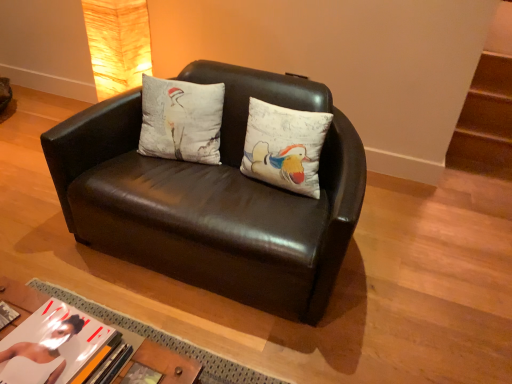
Question: Can you confirm if matte beige lampshade at upper left is smaller than matte paper book at lower left, arranged as the first book when viewed from the left?

Choices:
 (A) no
 (B) yes

Answer: (A)

Question: Considering the relative sizes of matte beige lampshade at upper left and matte paper book at lower left, which is the second book in right-to-left order, in the image provided, is matte beige lampshade at upper left bigger than matte paper book at lower left, which is the second book in right-to-left order,?

Choices:
 (A) no
 (B) yes

Answer: (B)

Question: Considering the relative sizes of matte beige lampshade at upper left and matte paper book at lower left, which is the second book in right-to-left order, in the image provided, is matte beige lampshade at upper left taller than matte paper book at lower left, which is the second book in right-to-left order,?

Choices:
 (A) no
 (B) yes

Answer: (B)

Question: Are matte beige lampshade at upper left and matte paper book at lower left, which is the second book in right-to-left order, located far from each other?

Choices:
 (A) no
 (B) yes

Answer: (B)

Question: Is matte beige lampshade at upper left to the left of matte paper book at lower left, which is the second book in right-to-left order, from the viewer's perspective?

Choices:
 (A) no
 (B) yes

Answer: (B)

Question: From the image's perspective, relative to matte beige lampshade at upper left, is matte black couch at center above or below?

Choices:
 (A) above
 (B) below

Answer: (B)

Question: Is matte black couch at center bigger or smaller than matte beige lampshade at upper left?

Choices:
 (A) big
 (B) small

Answer: (A)

Question: Does point (359, 157) appear closer or farther from the camera than point (135, 46)?

Choices:
 (A) farther
 (B) closer

Answer: (B)

Question: Would you say matte black couch at center is inside or outside matte beige lampshade at upper left?

Choices:
 (A) outside
 (B) inside

Answer: (A)

Question: Is point coord(178,119) closer or farther from the camera than point coord(90,49)?

Choices:
 (A) closer
 (B) farther

Answer: (A)

Question: Is white cotton cushion at center spatially inside matte beige lampshade at upper left, or outside of it?

Choices:
 (A) inside
 (B) outside

Answer: (B)

Question: From the image's perspective, relative to matte beige lampshade at upper left, is white cotton cushion at center above or below?

Choices:
 (A) above
 (B) below

Answer: (B)

Question: Is white cotton cushion at center taller or shorter than matte beige lampshade at upper left?

Choices:
 (A) tall
 (B) short

Answer: (B)

Question: Considering the positions of matte paper book at lower left, arranged as the first book when viewed from the left, and hardcover book at lower center, placed as the 1th book when sorted from right to left, in the image, is matte paper book at lower left, arranged as the first book when viewed from the left, wider or thinner than hardcover book at lower center, placed as the 1th book when sorted from right to left,?

Choices:
 (A) wide
 (B) thin

Answer: (A)

Question: Based on their sizes in the image, would you say matte paper book at lower left, which is the second book in right-to-left order, is bigger or smaller than hardcover book at lower center, placed as the 1th book when sorted from right to left?

Choices:
 (A) big
 (B) small

Answer: (A)